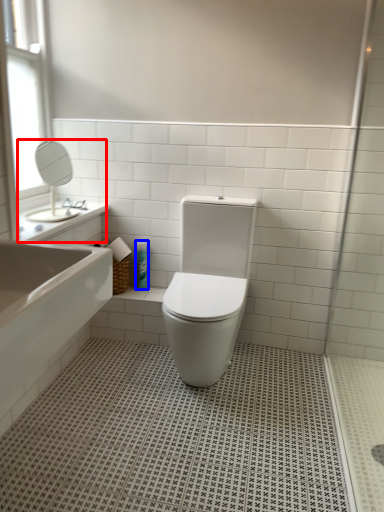
Question: Which point is closer to the camera, sink (highlighted by a red box) or toiletry (highlighted by a blue box)?

Choices:
 (A) sink
 (B) toiletry

Answer: (A)